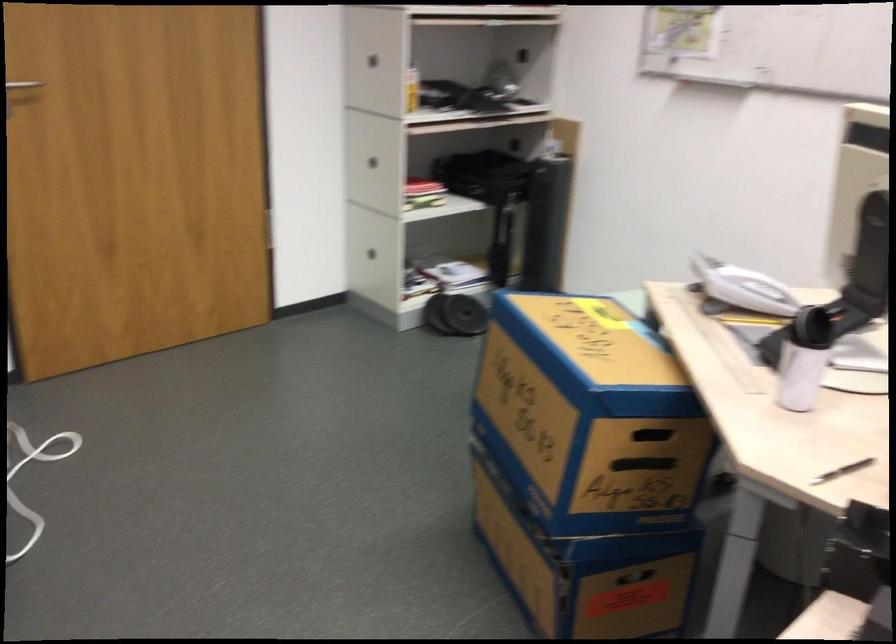
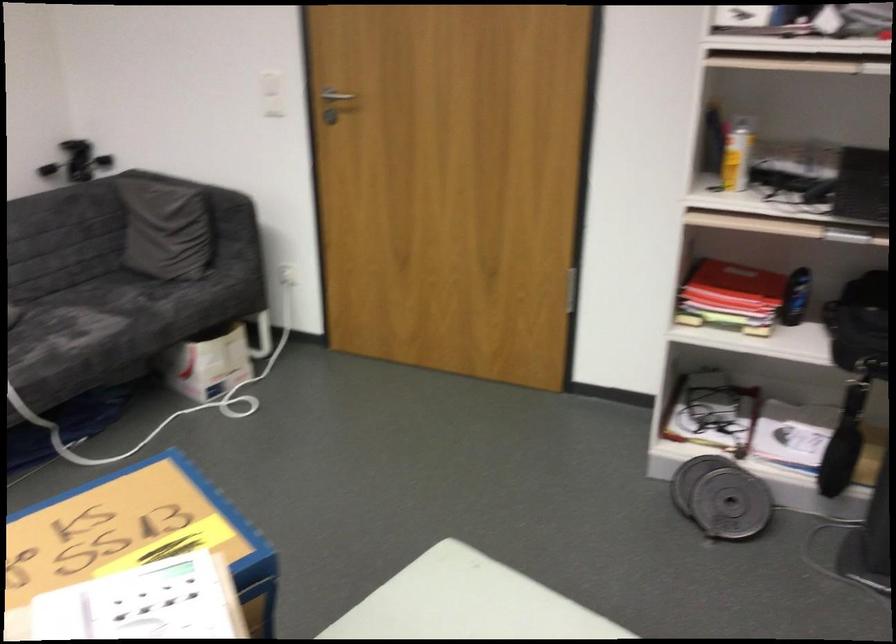
In the second image, find the point that corresponds to point 414,90 in the first image.

(736, 158)